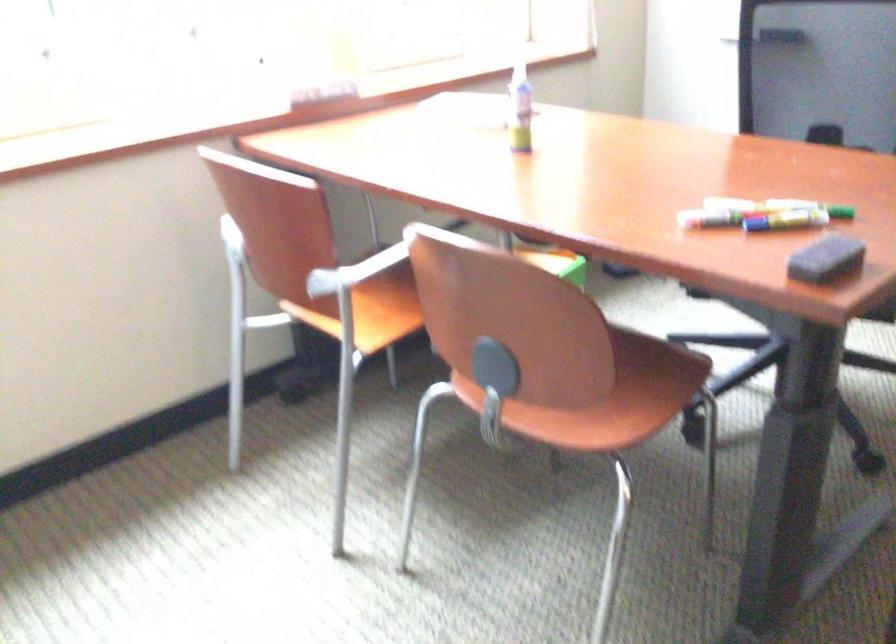
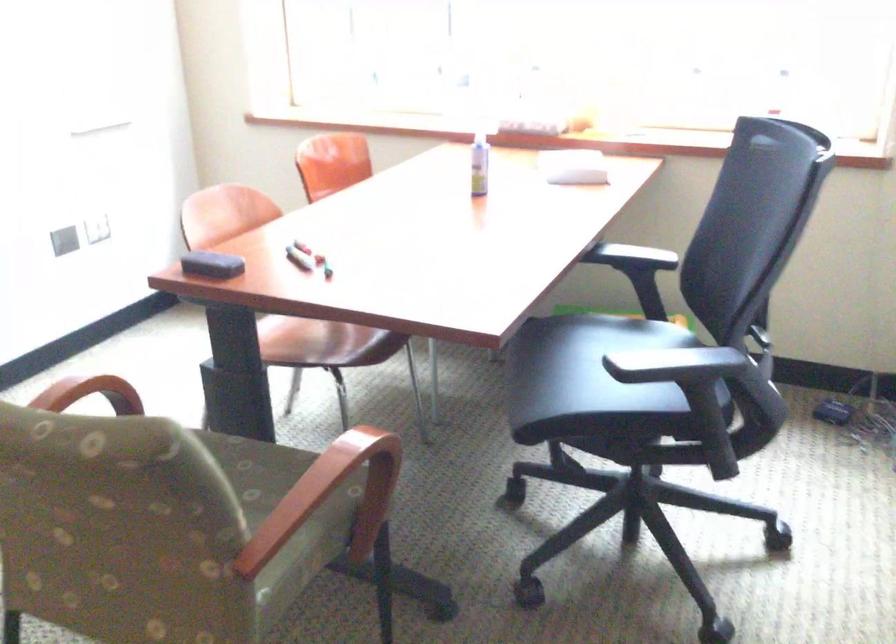
Where in the second image is the point corresponding to [544,402] from the first image?

(295, 336)